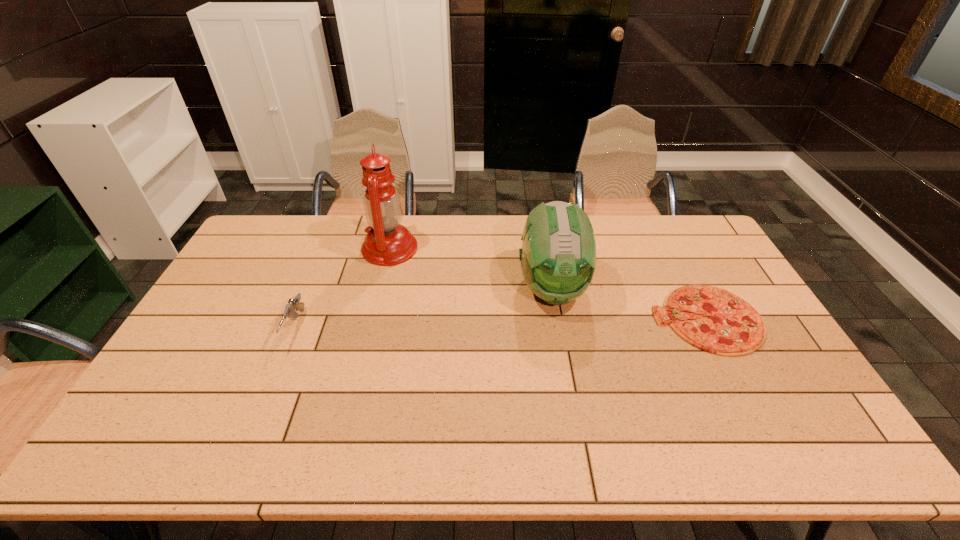
Locate an element on the screen. The width and height of the screenshot is (960, 540). empty space that is in between the padlock and the shortest object is located at coordinates (637, 274).

Identify the location of unoccupied area between the padlock and the rightmost object. (637, 274).

You are a GUI agent. You are given a task and a screenshot of the screen. Output one action in this format:
    pyautogui.click(x=<x>, y=<y>)
    Task: Click on the object that is the second closest one to the second shortest object
    Image resolution: width=960 pixels, height=540 pixels.
    Given the screenshot: What is the action you would take?
    pyautogui.click(x=558, y=256)

Select which object appears as the second closest to the third tallest object. Please provide its 2D coordinates. Your answer should be formatted as a tuple, i.e. [(x, y)], where the tuple contains the x and y coordinates of a point satisfying the conditions above.

[(730, 326)]